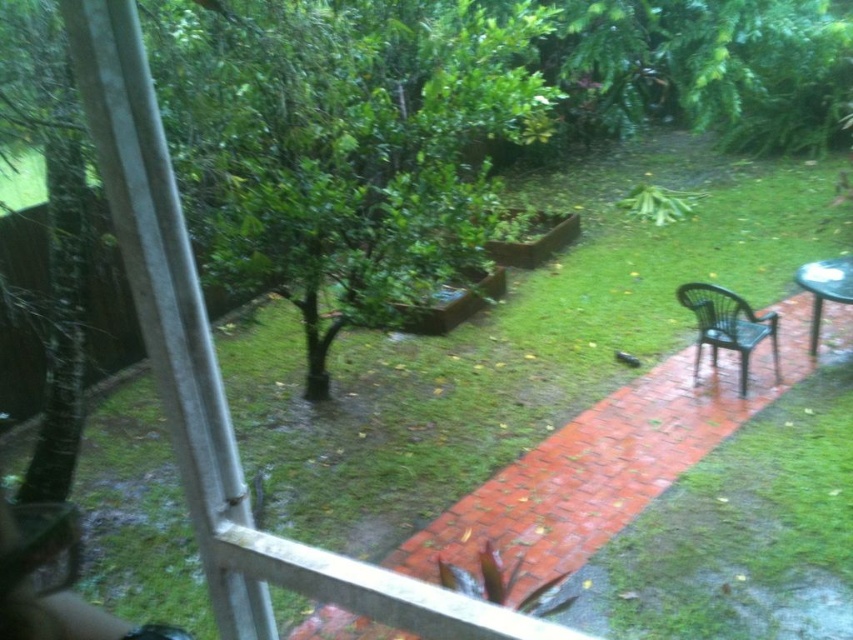
You are a delivery person trying to place a large package between the black plastic chair at right and the metallic silver table at right. The package is 1.2 meters wide. Can you fit it there?

The black plastic chair at right is wider than the metallic silver table at right. Since the package is 1.2 meters wide, you need to check the available space between them. However, the description only provides information about their widths, not the distance between them. Without knowing the distance between the two objects, it is impossible to determine if the package will fit.

You are standing inside the room where the window is located. You want to place a new potted plant exactly where the point at (728,326) is marked. Based on the scene description, where should you place the potted plant?

The point at (728,326) indicates the location of the black plastic chair at right, so you should place the potted plant where the black plastic chair at right is located.

You are a delivery robot with a package that needs to be placed between the black plastic chair at right and the metallic silver table at right. The package is 20 inches long. Can it fit in the space between them?

The space between the black plastic chair at right and the metallic silver table at right is 18.62 inches. Since the package is 20 inches long, it cannot fit in the space between them.